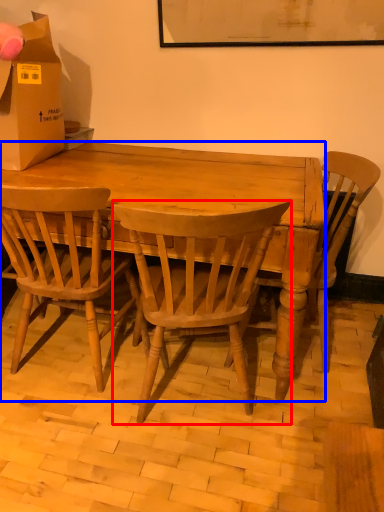
Question: Which of the following is the closest to the observer, chair (highlighted by a red box) or desk (highlighted by a blue box)?

Choices:
 (A) chair
 (B) desk

Answer: (A)